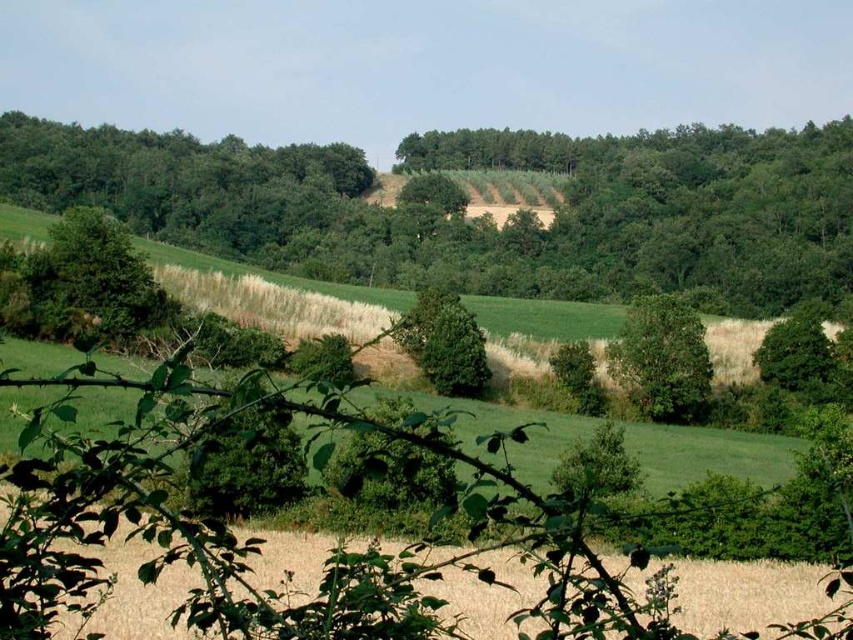
You are an artist sketching this rural landscape. You want to emphasize the scale difference between the green leafy tree at upper center and the green leafy tree at left. Which tree should you draw wider in your sketch?

You should draw the green leafy tree at upper center wider because its width is larger than the green leafy tree at left.